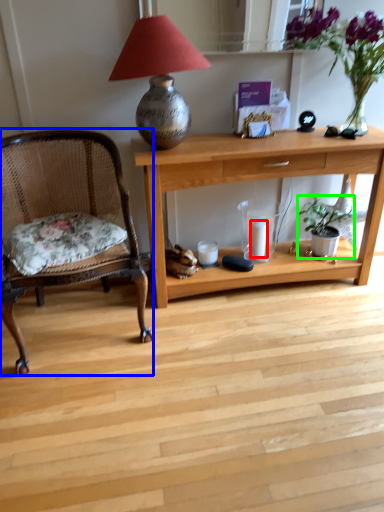
Question: Considering the real-world distances, which object is closest to candle (highlighted by a red box)? chair (highlighted by a blue box) or houseplant (highlighted by a green box).

Choices:
 (A) chair
 (B) houseplant

Answer: (B)